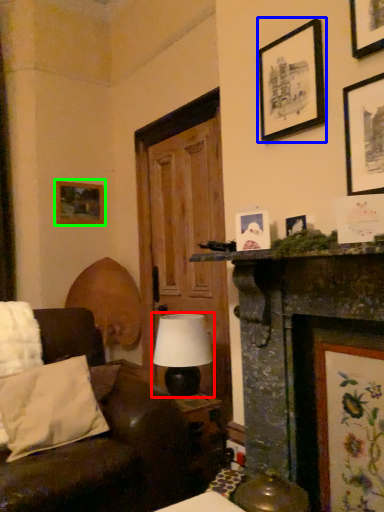
Question: Considering the real-world distances, which object is farthest from table lamp (highlighted by a red box)? picture frame (highlighted by a blue box) or picture frame (highlighted by a green box)?

Choices:
 (A) picture frame
 (B) picture frame

Answer: (B)